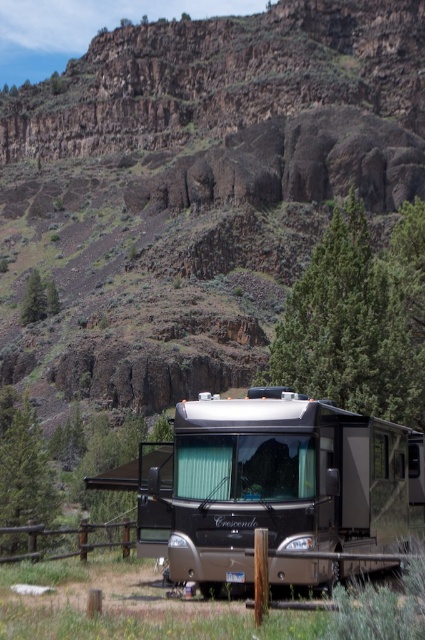
You are a hiker who has just arrived at the campsite. You see the metallic silver rv at center and the green textured pine tree at upper left. Which object is positioned more to the left side of the scene?

The green textured pine tree at upper left is positioned more to the left side of the scene than the metallic silver rv at center.

You are a drone operator trying to capture the metallic silver rv at center from above. What are the coordinates you should aim for?

The coordinates to aim for are (277, 483).

You are a hiker planning to take a photo of the rugged rock hillside at upper center and the green textured tree at center. Which object should you focus on first if you want to capture both in a single frame without moving the camera?

The rugged rock hillside at upper center is wider than the green textured tree at center, so you should focus on the rugged rock hillside at upper center first to ensure it fits within the frame.